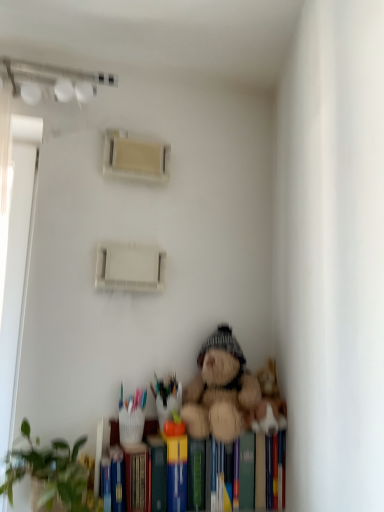
Question: From the image's perspective, is green matte plant at lower left above or below fuzzy brown teddy bear at lower center?

Choices:
 (A) above
 (B) below

Answer: (B)

Question: Would you say green matte plant at lower left is to the left or to the right of fuzzy brown teddy bear at lower center in the picture?

Choices:
 (A) right
 (B) left

Answer: (B)

Question: Which object is the farthest from the fuzzy brown teddy bear at lower center?

Choices:
 (A) hardcover book at lower center
 (B) hardcover books at lower center
 (C) green matte plant at lower left

Answer: (C)

Question: Estimate the real-world distances between objects in this image. Which object is closer to the hardcover books at lower center?

Choices:
 (A) green matte plant at lower left
 (B) fuzzy brown teddy bear at lower center
 (C) hardcover book at lower center

Answer: (C)